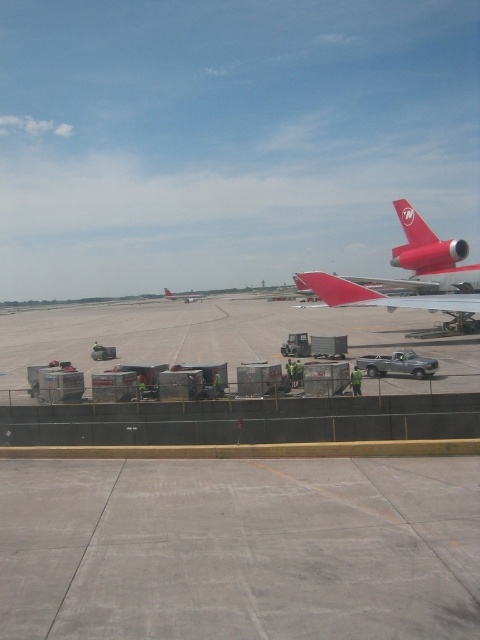
You are a pilot who needs to board your aircraft. You see the red matte airplane at center and the metallic silver airplane at center. Which one is shorter in height?

The red matte airplane at center is shorter in height compared to the metallic silver airplane at center.

From the picture: You are standing on the airport tarmac and want to know how far you are from the point marked at coordinates point (x=365, y=292). Can you determine the distance?

The distance between you and the point marked at coordinates point (x=365, y=292) is 29.41 meters.

You are a ground crew member who needs to determine which airplane is smaller in size between the red matte airplane at center and the metallic silver airplane at center. Based on the scene, which one should you report as the smaller one?

The red matte airplane at center has a smaller size compared to the metallic silver airplane at center, so you should report the red matte airplane at center as the smaller one.